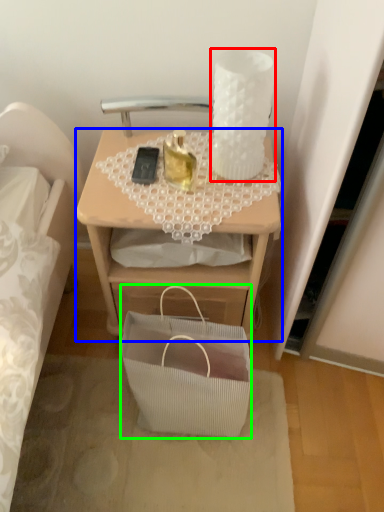
Question: Which object is positioned closest to candle holder (highlighted by a red box)? Select from desk (highlighted by a blue box) and handbag (highlighted by a green box).

Choices:
 (A) desk
 (B) handbag

Answer: (A)